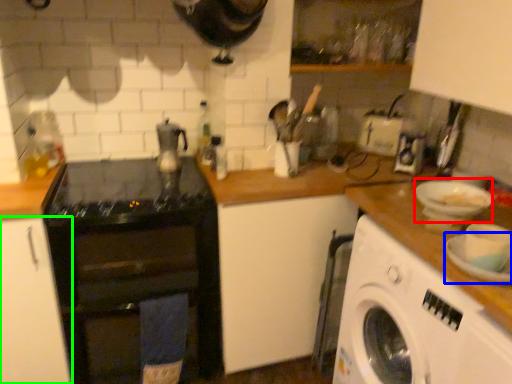
Question: Which is nearer to the basin (highlighted by a red box)? plate (highlighted by a blue box) or cabinetry (highlighted by a green box).

Choices:
 (A) plate
 (B) cabinetry

Answer: (A)